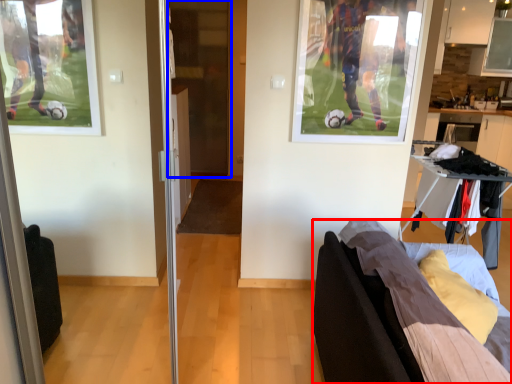
Question: Which object is closer to the camera taking this photo, furniture (highlighted by a red box) or screen door (highlighted by a blue box)?

Choices:
 (A) furniture
 (B) screen door

Answer: (A)